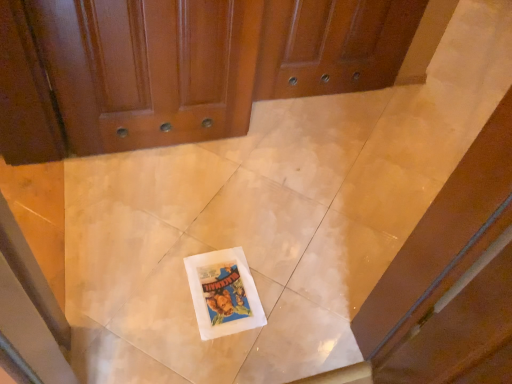
Measure the distance between point (x=239, y=131) and camera.

Point (x=239, y=131) is 1.85 meters from camera.

Image resolution: width=512 pixels, height=384 pixels. What do you see at coordinates (170, 68) in the screenshot? I see `glossy wood door at upper center` at bounding box center [170, 68].

Identify the location of glossy wood door at upper center. The image size is (512, 384). (170, 68).

Measure the distance between glossy wood door at upper center and camera.

glossy wood door at upper center is 1.25 meters from camera.

This screenshot has height=384, width=512. Identify the location of white paper comic book at center. (223, 293).

Image resolution: width=512 pixels, height=384 pixels. Describe the element at coordinates (223, 293) in the screenshot. I see `white paper comic book at center` at that location.

Locate an element on the screen. This screenshot has height=384, width=512. glossy wood door at upper center is located at coordinates (170, 68).

Which object is positioned more to the right, glossy wood door at upper center or white paper comic book at center?

white paper comic book at center is more to the right.

Considering their positions, is glossy wood door at upper center located in front of or behind white paper comic book at center?

In the image, glossy wood door at upper center appears in front of white paper comic book at center.

From the picture: Which is closer to the camera, (147, 103) or (228, 287)?

Point (147, 103) is positioned farther from the camera compared to point (228, 287).

From the image's perspective, is glossy wood door at upper center located above or below white paper comic book at center?

Clearly, from the image's perspective, glossy wood door at upper center is above white paper comic book at center.

From a real-world perspective, who is located higher, glossy wood door at upper center or white paper comic book at center?

In real-world perspective, glossy wood door at upper center is above.

From the picture: Between glossy wood door at upper center and white paper comic book at center, which one has larger width?

With larger width is white paper comic book at center.

Can you confirm if glossy wood door at upper center is shorter than white paper comic book at center?

No, glossy wood door at upper center is not shorter than white paper comic book at center.

Which of these two, glossy wood door at upper center or white paper comic book at center, is smaller?

white paper comic book at center is smaller.

Is glossy wood door at upper center spatially inside white paper comic book at center, or outside of it?

glossy wood door at upper center is outside white paper comic book at center.

Are glossy wood door at upper center and white paper comic book at center far apart?

That's not correct — glossy wood door at upper center is a little close to white paper comic book at center.

Is glossy wood door at upper center looking in the opposite direction of white paper comic book at center?

glossy wood door at upper center is not turned away from white paper comic book at center.

How different are the orientations of glossy wood door at upper center and white paper comic book at center in degrees?

0.784 degrees.

Identify the location of door on the left of the white paper comic book at center. (170, 68).

Can you confirm if white paper comic book at center is positioned to the left of glossy wood door at upper center?

In fact, white paper comic book at center is to the right of glossy wood door at upper center.

Considering the relative positions of white paper comic book at center and glossy wood door at upper center in the image provided, is white paper comic book at center behind glossy wood door at upper center?

Yes, white paper comic book at center is further from the camera.

Does point (207, 318) appear closer or farther from the camera than point (152, 85)?

Clearly, point (207, 318) is closer to the camera than point (152, 85).

From the image's perspective, would you say white paper comic book at center is shown under glossy wood door at upper center?

Yes, from the image's perspective, white paper comic book at center is below glossy wood door at upper center.

In the scene shown: From a real-world perspective, who is located lower, white paper comic book at center or glossy wood door at upper center?

white paper comic book at center is physically lower.

From the picture: Which of these two, white paper comic book at center or glossy wood door at upper center, is thinner?

With smaller width is glossy wood door at upper center.

Consider the image. Which of these two, white paper comic book at center or glossy wood door at upper center, stands shorter?

Standing shorter between the two is white paper comic book at center.

Consider the image. Which of these two, white paper comic book at center or glossy wood door at upper center, is bigger?

glossy wood door at upper center.

Do you think white paper comic book at center is within glossy wood door at upper center, or outside of it?

white paper comic book at center exists outside the volume of glossy wood door at upper center.

Is white paper comic book at center next to glossy wood door at upper center?

No.

Is white paper comic book at center turned away from glossy wood door at upper center?

white paper comic book at center is not turned away from glossy wood door at upper center.

Based on the photo, how far apart are white paper comic book at center and glossy wood door at upper center?

white paper comic book at center is 27.20 inches from glossy wood door at upper center.

The height and width of the screenshot is (384, 512). What are the coordinates of `comic book below the glossy wood door at upper center (from the image's perspective)` in the screenshot? It's located at (223, 293).

Image resolution: width=512 pixels, height=384 pixels. Identify the location of comic book lying behind the glossy wood door at upper center. (223, 293).

This screenshot has height=384, width=512. In the image, there is a white paper comic book at center. Find the location of `door above it (from the image's perspective)`. door above it (from the image's perspective) is located at coordinates coord(170,68).